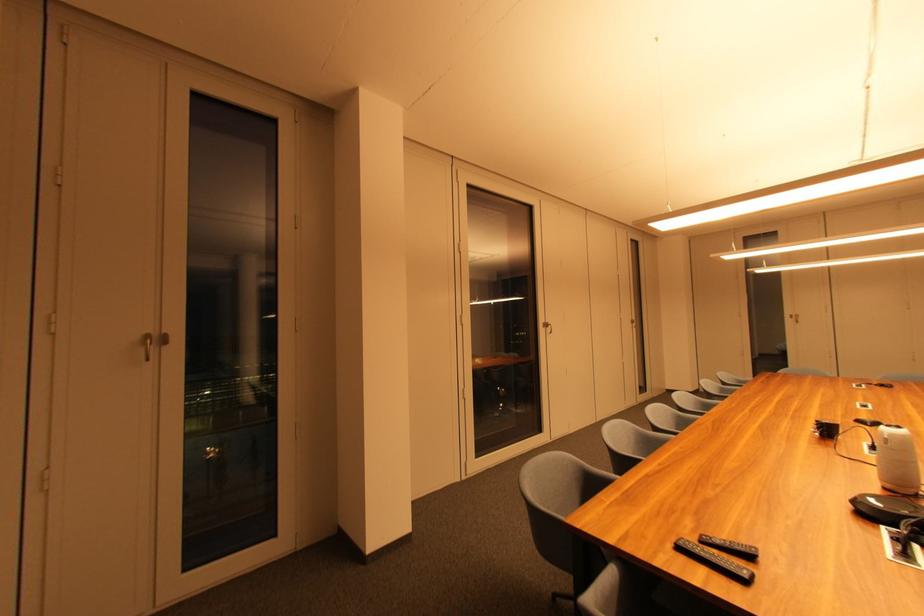
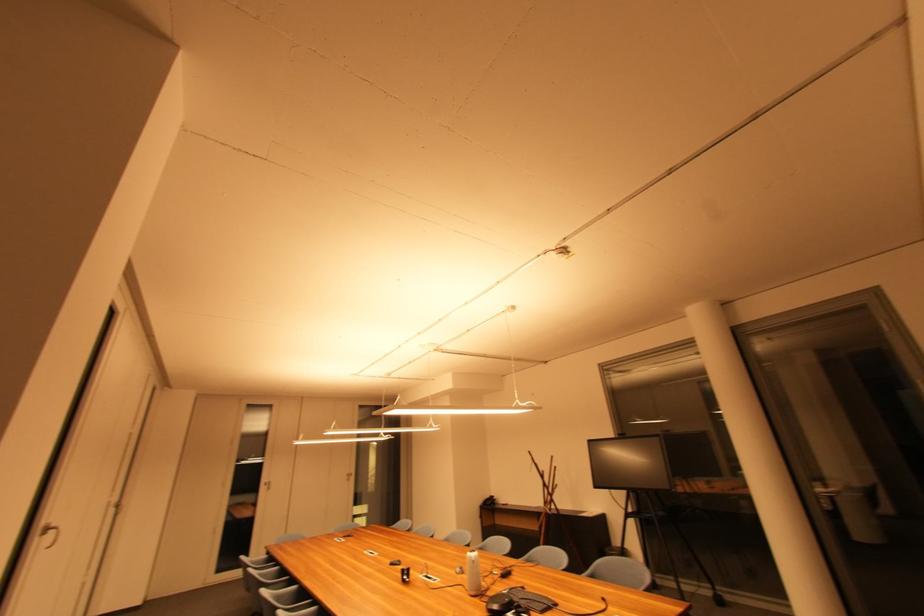
Where in the second image is the point corresponding to the point at 796,318 from the first image?

(271, 485)